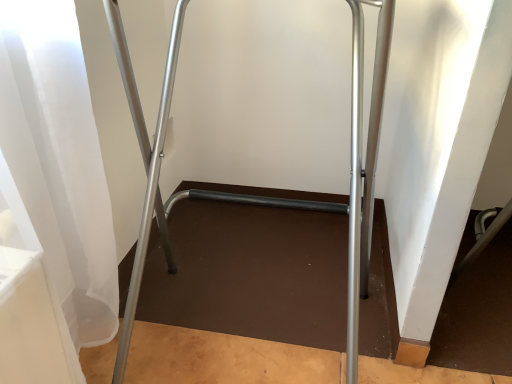
Question: Should I look upward or downward to see silver metallic crutch at center?

Choices:
 (A) down
 (B) up

Answer: (A)